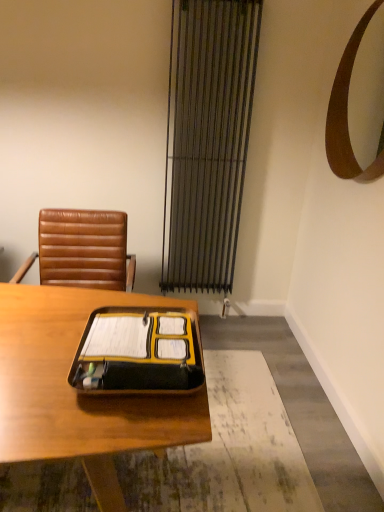
Question: Does yellow matte folder at center have a larger size compared to wooden desk at center?

Choices:
 (A) no
 (B) yes

Answer: (A)

Question: From the image's perspective, is yellow matte folder at center located beneath wooden desk at center?

Choices:
 (A) yes
 (B) no

Answer: (B)

Question: Does yellow matte folder at center have a smaller size compared to wooden desk at center?

Choices:
 (A) no
 (B) yes

Answer: (B)

Question: From a real-world perspective, is yellow matte folder at center positioned over wooden desk at center based on gravity?

Choices:
 (A) yes
 (B) no

Answer: (A)

Question: Is yellow matte folder at center aimed at wooden desk at center?

Choices:
 (A) no
 (B) yes

Answer: (A)

Question: Considering the positions of yellow matte folder at center and brown leather chair at upper left in the image, is yellow matte folder at center bigger or smaller than brown leather chair at upper left?

Choices:
 (A) big
 (B) small

Answer: (B)

Question: Based on their positions, is yellow matte folder at center located to the left or right of brown leather chair at upper left?

Choices:
 (A) right
 (B) left

Answer: (A)

Question: From their relative heights in the image, would you say yellow matte folder at center is taller or shorter than brown leather chair at upper left?

Choices:
 (A) tall
 (B) short

Answer: (B)

Question: Do you think yellow matte folder at center is within brown leather chair at upper left, or outside of it?

Choices:
 (A) outside
 (B) inside

Answer: (A)

Question: Considering their positions, is metallic silver curtain at center located in front of or behind yellow matte folder at center?

Choices:
 (A) behind
 (B) front

Answer: (A)

Question: Is point (226, 40) positioned closer to the camera than point (172, 390)?

Choices:
 (A) farther
 (B) closer

Answer: (A)

Question: Is metallic silver curtain at center wider or thinner than yellow matte folder at center?

Choices:
 (A) wide
 (B) thin

Answer: (B)

Question: Considering the relative positions of metallic silver curtain at center and yellow matte folder at center in the image provided, is metallic silver curtain at center to the left or to the right of yellow matte folder at center?

Choices:
 (A) right
 (B) left

Answer: (A)

Question: Is wooden desk at center inside the boundaries of metallic silver curtain at center, or outside?

Choices:
 (A) outside
 (B) inside

Answer: (A)

Question: Would you say wooden desk at center is to the left or to the right of metallic silver curtain at center in the picture?

Choices:
 (A) right
 (B) left

Answer: (B)